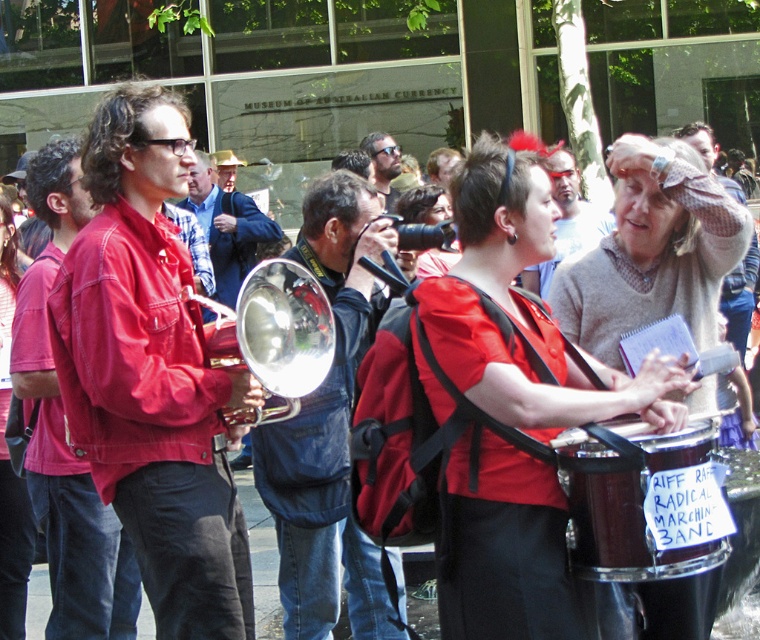
Is gray wool sweater at upper right smaller than matte black sunglasses at center?

No.

Is gray wool sweater at upper right to the right of matte black sunglasses at center from the viewer's perspective?

Indeed, gray wool sweater at upper right is positioned on the right side of matte black sunglasses at center.

I want to click on gray wool sweater at upper right, so click(x=565, y=220).

Who is more distant from viewer, (192, 595) or (575, 225)?

Point (575, 225)

Does matte red jacket at left have a lesser width compared to gray wool sweater at upper right?

Yes.

Is point (103, 333) positioned after point (572, 236)?

No, (103, 333) is closer to viewer.

What are the coordinates of `matte red jacket at left` in the screenshot? It's located at (152, 372).

Can you confirm if shiny silver trumpet at center is positioned to the right of matte black sunglasses at center?

Incorrect, shiny silver trumpet at center is not on the right side of matte black sunglasses at center.

Does shiny silver trumpet at center appear over matte black sunglasses at center?

No, shiny silver trumpet at center is not above matte black sunglasses at center.

I want to click on shiny silver trumpet at center, so click(x=328, y=429).